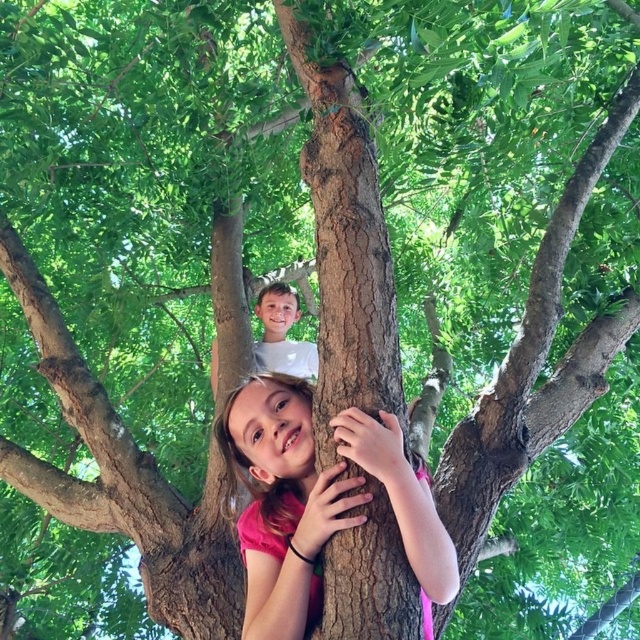
Is point (392, 422) closer to camera compared to point (289, 310)?

Yes, it is.

Which of these two, pink matte shirt at center or white matte shirt at upper center, stands taller?

pink matte shirt at center

Between point (429, 561) and point (273, 305), which one is positioned behind?

The point (273, 305) is behind.

Identify the location of pink matte shirt at center. This screenshot has width=640, height=640. (282, 502).